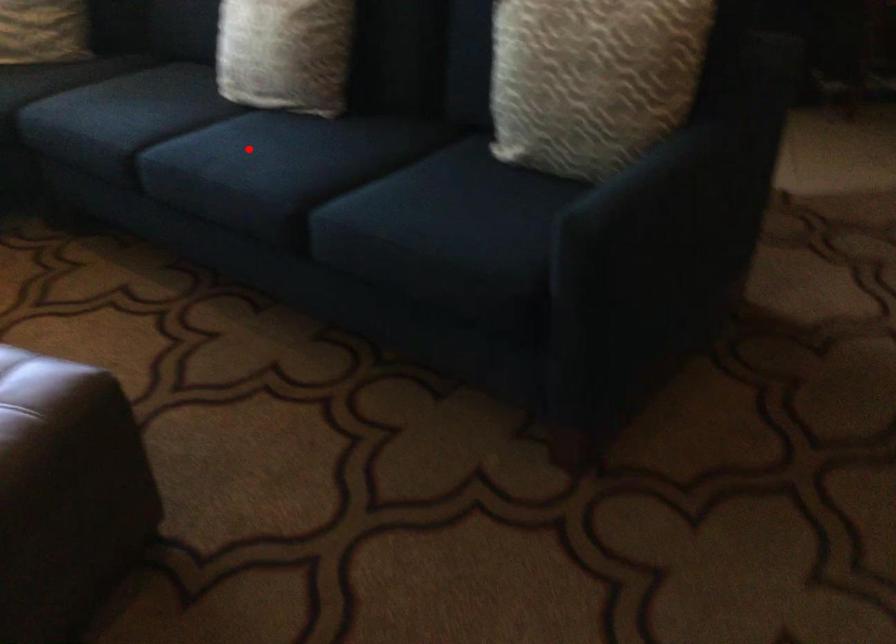
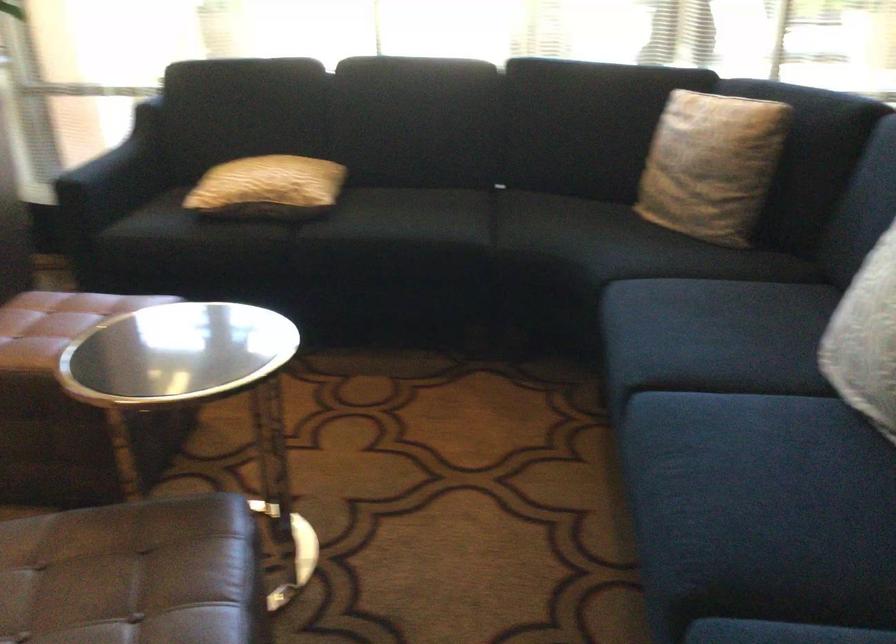
The point at the highlighted location is marked in the first image. Where is the corresponding point in the second image?

(745, 459)